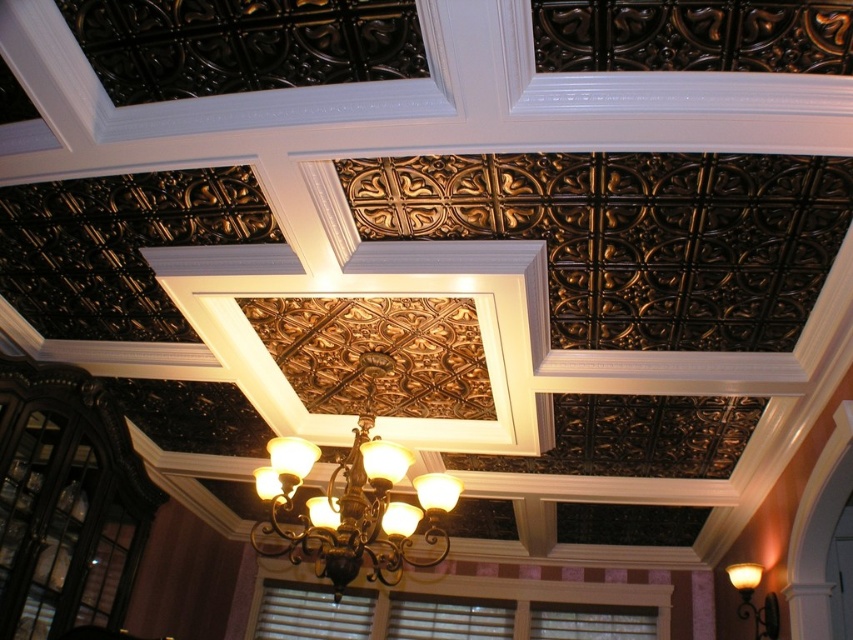
Question: Which of the following is the closest to the observer?

Choices:
 (A) matte gold wall sconce at upper right
 (B) bronze textured chandelier at center

Answer: (B)

Question: Does bronze textured chandelier at center come behind matte gold wall sconce at upper right?

Choices:
 (A) yes
 (B) no

Answer: (B)

Question: Is bronze textured chandelier at center closer to camera compared to matte gold wall sconce at upper right?

Choices:
 (A) yes
 (B) no

Answer: (A)

Question: Observing the image, what is the correct spatial positioning of bronze textured chandelier at center in reference to matte gold wall sconce at upper right?

Choices:
 (A) above
 (B) below

Answer: (A)